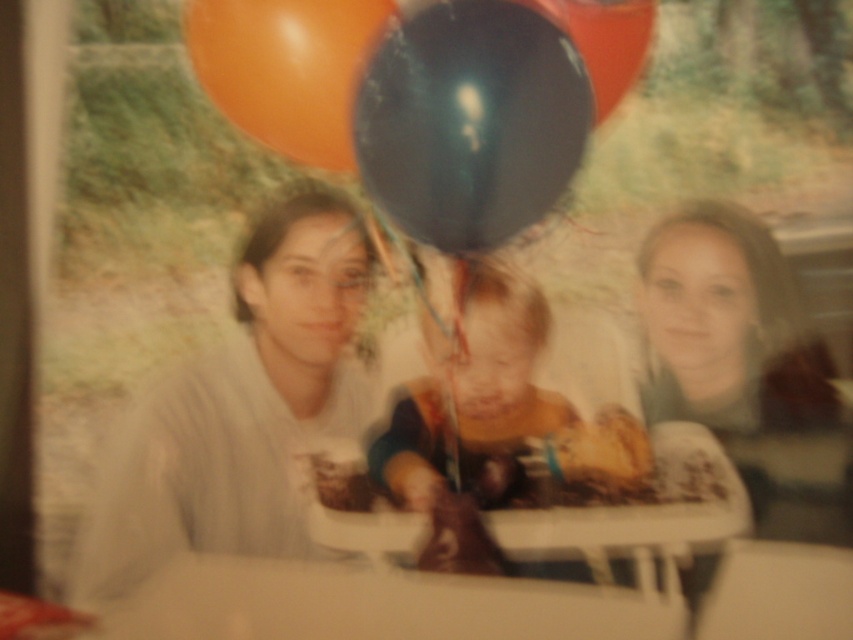
Question: Among these objects, which one is farthest from the camera?

Choices:
 (A) matte gray sweater at upper right
 (B) orange rubber balloon at upper left
 (C) matte gray sweater at left
 (D) white plastic table at lower center

Answer: (C)

Question: Does black rubber balloon at upper center appear over orange rubber balloon at upper left?

Choices:
 (A) yes
 (B) no

Answer: (B)

Question: Does matte gray sweater at left have a smaller size compared to matte gray sweater at upper right?

Choices:
 (A) no
 (B) yes

Answer: (A)

Question: Is matte gray sweater at left bigger than matte gray sweater at upper right?

Choices:
 (A) yes
 (B) no

Answer: (A)

Question: Which object is farther from the camera taking this photo?

Choices:
 (A) matte gray sweater at upper right
 (B) black rubber balloon at upper center
 (C) orange rubber balloon at upper left

Answer: (A)

Question: Among these points, which one is nearest to the camera?

Choices:
 (A) (248, 349)
 (B) (316, 148)

Answer: (B)